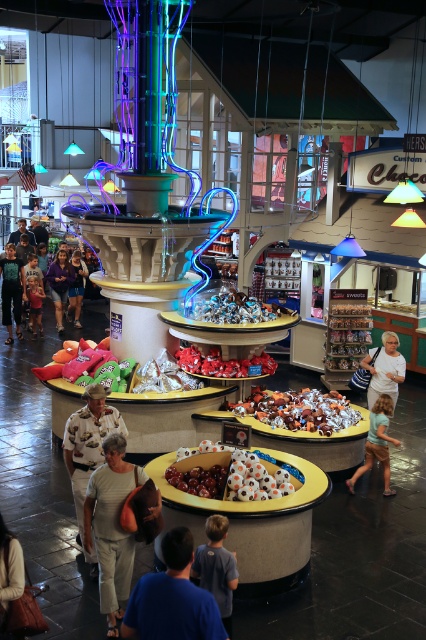
You are a visitor standing in front of the multi tiered display stand. You see two points marked on the stand. One is at point (x=161, y=595) and the other is at point (x=224, y=522). Which of these points is closer to you?

Point (x=161, y=595) is in front of point (x=224, y=522), so it is closer to you.

You are a customer in the store and you want to grab both the white cotton shirt at right and the light brown leather jacket at lower left. Which one is located to your right side?

The white cotton shirt at right is located on the right side of the light brown leather jacket at lower left, so the white cotton shirt at right is on your right side.